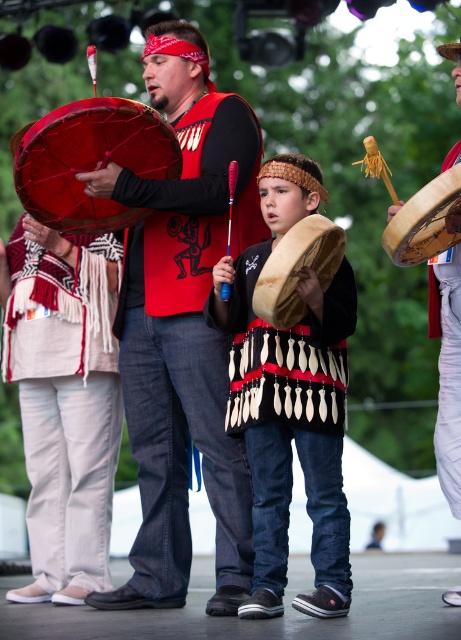
Question: Estimate the real-world distances between objects in this image. Which object is closer to the leather drum at right?

Choices:
 (A) fur-like brown drum at center
 (B) matte red drum at center
 (C) shiny red drum at center

Answer: (A)

Question: Does matte red drum at center have a smaller size compared to velvet brown drum at center?

Choices:
 (A) no
 (B) yes

Answer: (B)

Question: Which object is farther from the camera taking this photo?

Choices:
 (A) shiny red drum at center
 (B) leather drum at right
 (C) matte red drum at center
 (D) fur-like brown drum at center

Answer: (C)

Question: Estimate the real-world distances between objects in this image. Which object is farther from the shiny red drum at center?

Choices:
 (A) leather drum at right
 (B) fur-like brown drum at center
 (C) matte red drum at center
 (D) white woven fabric at lower left

Answer: (C)

Question: Considering the relative positions of velvet brown drum at center and fur-like brown drum at center in the image provided, where is velvet brown drum at center located with respect to fur-like brown drum at center?

Choices:
 (A) left
 (B) right

Answer: (A)

Question: Does velvet brown drum at center have a smaller size compared to shiny red drum at center?

Choices:
 (A) yes
 (B) no

Answer: (B)